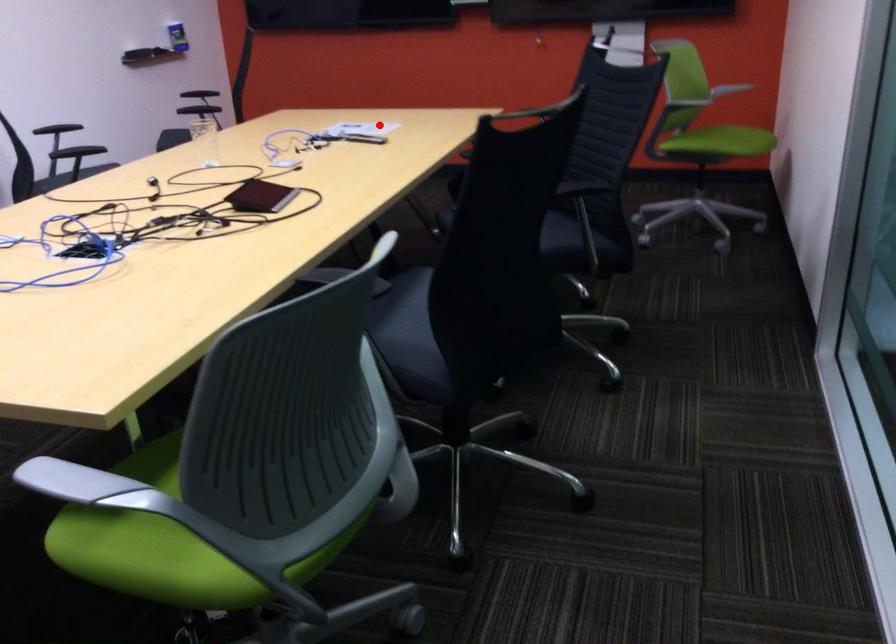
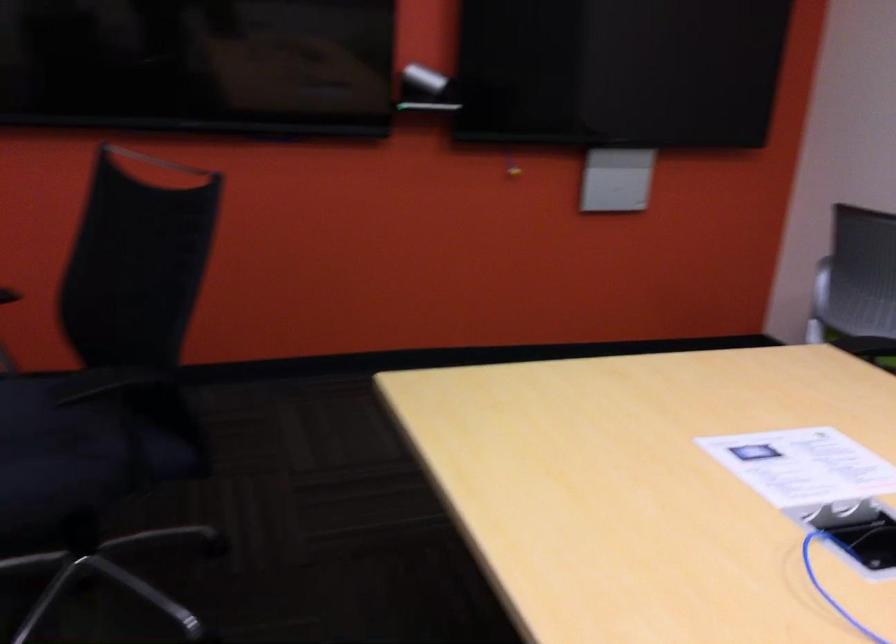
Question: I am providing you with two images of the same scene from different viewpoints. Given a red point in image1, look at the same physical point in image2. Is it:

Choices:
 (A) Closer to the viewpoint
 (B) Farther from the viewpoint

Answer: (A)